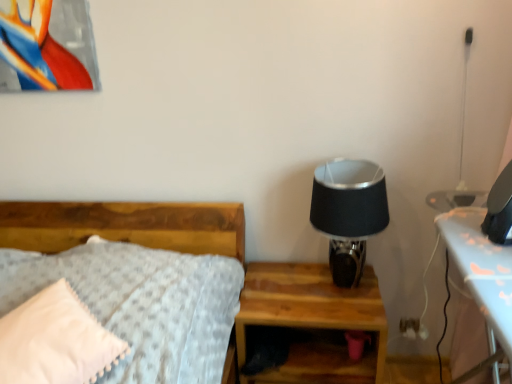
Where is `vacant space underneath black fabric lampshade at upper right (from a real-world perspective)`? This screenshot has width=512, height=384. vacant space underneath black fabric lampshade at upper right (from a real-world perspective) is located at coordinates (343, 288).